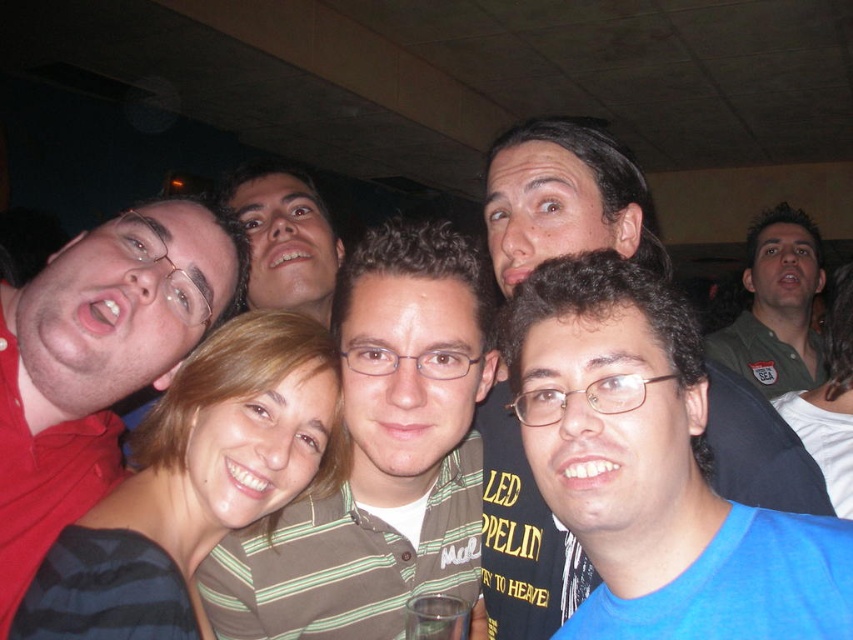
Question: Does blue matte shirt at center have a greater width compared to green uniform shirt at upper right?

Choices:
 (A) no
 (B) yes

Answer: (A)

Question: Which of these objects is positioned farthest from the green uniform shirt at upper right?

Choices:
 (A) green striped shirt at center
 (B) blue matte shirt at center

Answer: (A)

Question: Considering the relative positions of matte red shirt at left and blue matte shirt at center in the image provided, where is matte red shirt at left located with respect to blue matte shirt at center?

Choices:
 (A) below
 (B) above

Answer: (A)

Question: Is green striped shirt at center to the left of blue matte shirt at center from the viewer's perspective?

Choices:
 (A) yes
 (B) no

Answer: (A)

Question: Which point is farther from the camera taking this photo?

Choices:
 (A) (428, 349)
 (B) (744, 410)
 (C) (793, 371)

Answer: (C)

Question: Which is nearer to the blue matte shirt at center?

Choices:
 (A) green striped shirt at center
 (B) green uniform shirt at upper right

Answer: (A)